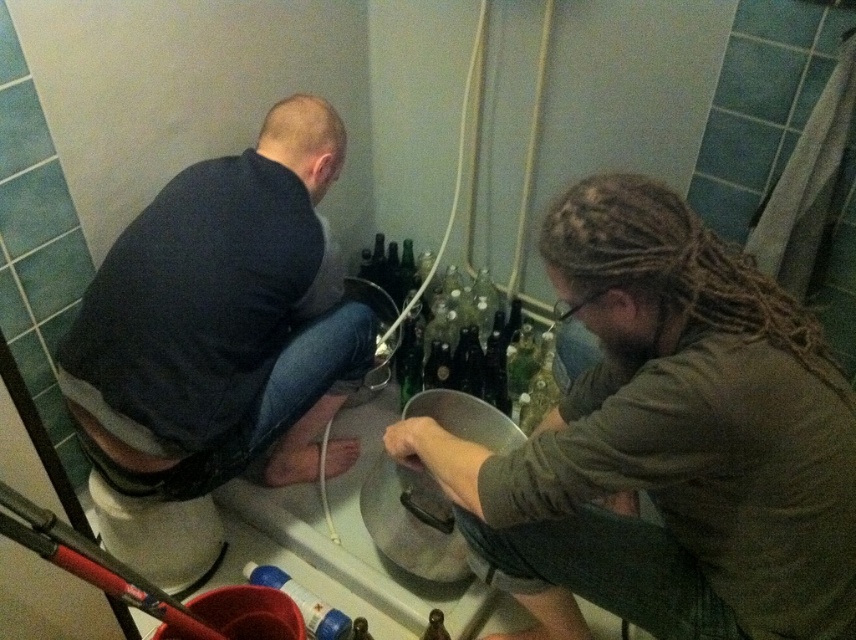
You are standing in the room and want to find the point at coordinate (221, 321). Which object is this point located on?

The point at coordinate (221, 321) is located on the dark gray shirt at left.

You are a photographer trying to capture a photo of the dark gray shirt at left and the blue plastic bottle at lower center. Which object should you focus on first if you want to ensure both are in focus without adjusting the camera settings?

The dark gray shirt at left is taller than the blue plastic bottle at lower center. Since depth of field is typically greater for objects at similar distances, focusing on the dark gray shirt at left first would help ensure both are in focus as they are likely at a similar distance but the shirt is larger in the frame.

In the scene shown: You are standing in the room and see the dark gray shirt at left and the blue plastic bottle at lower center. Which object is located more to the left?

The dark gray shirt at left is more to the left than the blue plastic bottle at lower center.